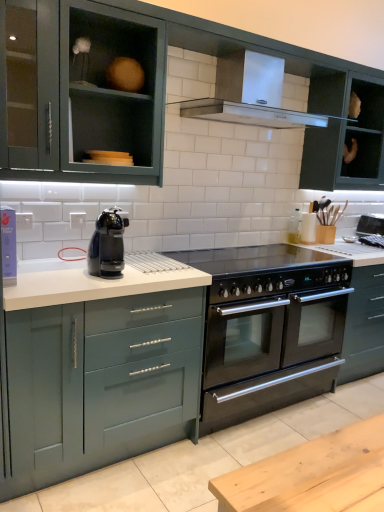
Question: From the image's perspective, is black plastic coffee machine at center located above or below satin silver range hood at upper center?

Choices:
 (A) below
 (B) above

Answer: (A)

Question: Considering their positions, is black plastic coffee machine at center located in front of or behind satin silver range hood at upper center?

Choices:
 (A) behind
 (B) front

Answer: (B)

Question: Estimate the real-world distances between objects in this image. Which object is farther from the matte teal cabinet at left, the fourth cabinetry from the top?

Choices:
 (A) matte green cabinet at upper left, positioned as the third cabinetry in bottom-to-top order
 (B) matte green cabinets at upper center, which is counted as the third cabinetry, starting from the top
 (C) black stainless steel oven at center
 (D) matte black cabinet at upper right, the first cabinetry in the top-to-bottom sequence
 (E) white matte countertop at lower center

Answer: (C)

Question: Based on their relative distances, which object is nearer to the matte green cabinets at upper center, the second cabinetry when ordered from bottom to top?

Choices:
 (A) black stainless steel oven at center
 (B) matte black cabinet at upper right, the 4th cabinetry when ordered from bottom to top
 (C) white matte countertop at lower center
 (D) black stainless steel oven at center
 (E) black glass cooktop at center

Answer: (B)